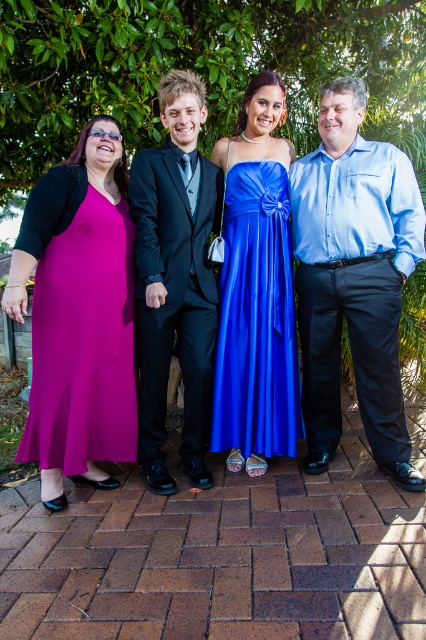
The width and height of the screenshot is (426, 640). What do you see at coordinates (192, 264) in the screenshot?
I see `matte blue dress at center` at bounding box center [192, 264].

Is matte blue dress at center shorter than fuchsia satin dress at left?

No, matte blue dress at center is not shorter than fuchsia satin dress at left.

Describe the element at coordinates (192, 264) in the screenshot. I see `matte blue dress at center` at that location.

What are the coordinates of `matte blue dress at center` in the screenshot? It's located at (192, 264).

Does green leafy tree at upper center appear on the right side of fuchsia satin dress at left?

Yes, green leafy tree at upper center is to the right of fuchsia satin dress at left.

Does point (74, 132) lie behind point (83, 180)?

Yes, point (74, 132) is behind point (83, 180).

The width and height of the screenshot is (426, 640). What are the coordinates of `green leafy tree at upper center` in the screenshot? It's located at (198, 68).

Which of these two, matte blue dress at center or blue shirt at right, stands taller?

matte blue dress at center

Who is more distant from viewer, (x=158, y=349) or (x=298, y=204)?

The point (x=298, y=204) is behind.

Is point (380, 468) behind point (345, 305)?

That is True.

Locate an element on the screen. matte blue dress at center is located at coordinates (192, 264).